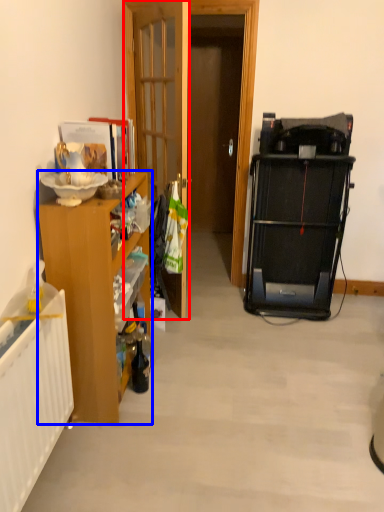
Question: Which object is further to the camera taking this photo, door (highlighted by a red box) or cabinetry (highlighted by a blue box)?

Choices:
 (A) door
 (B) cabinetry

Answer: (A)